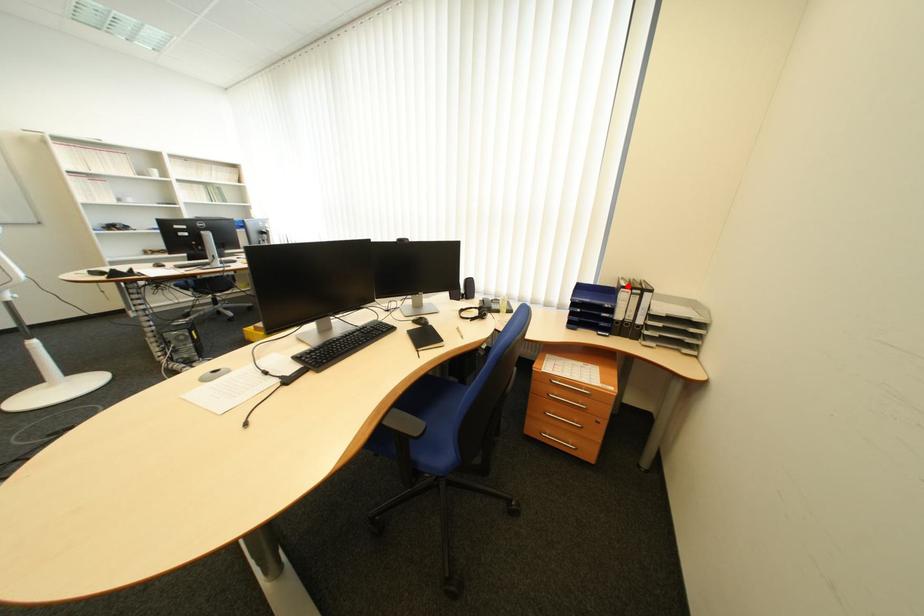
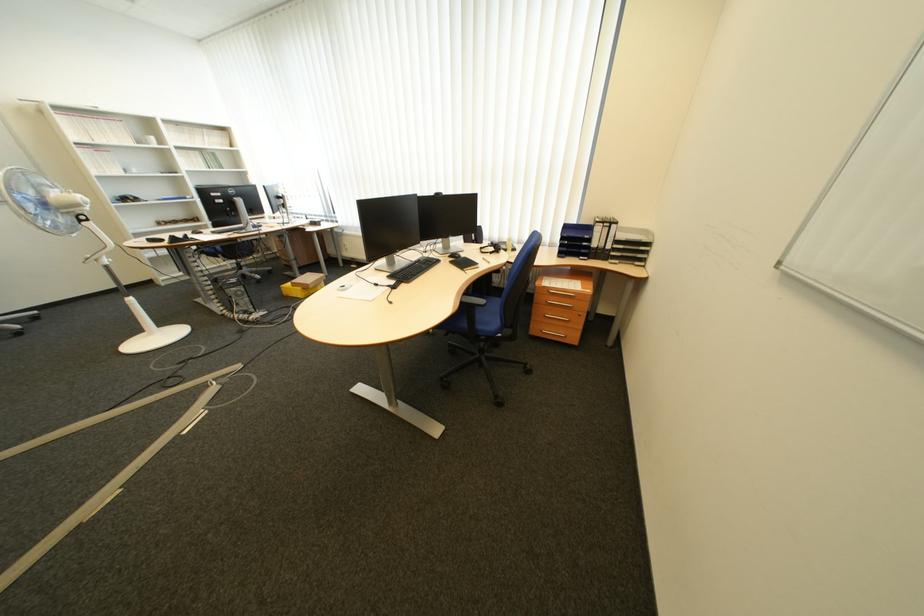
Where in the second image is the point corresponding to the highlighted location from the first image?

(604, 225)